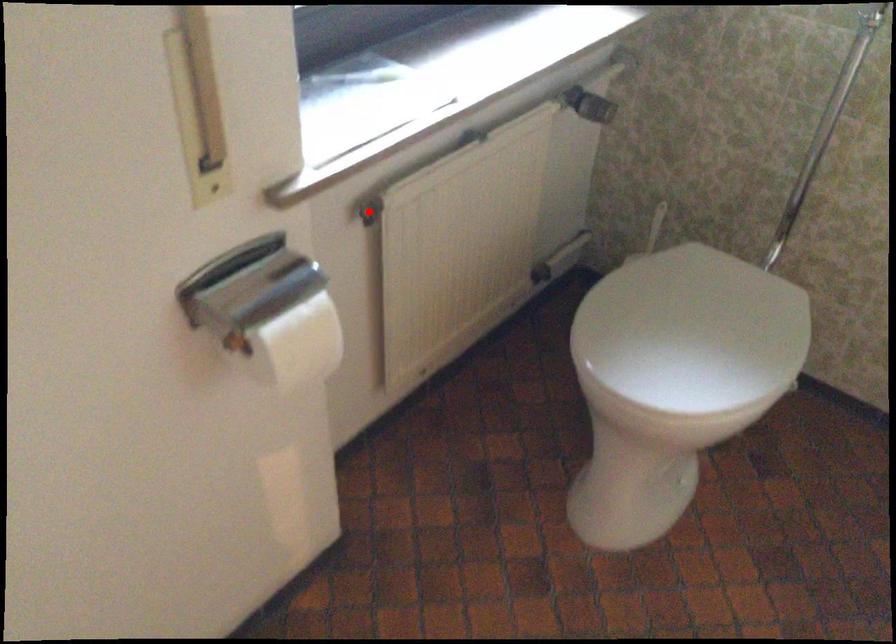
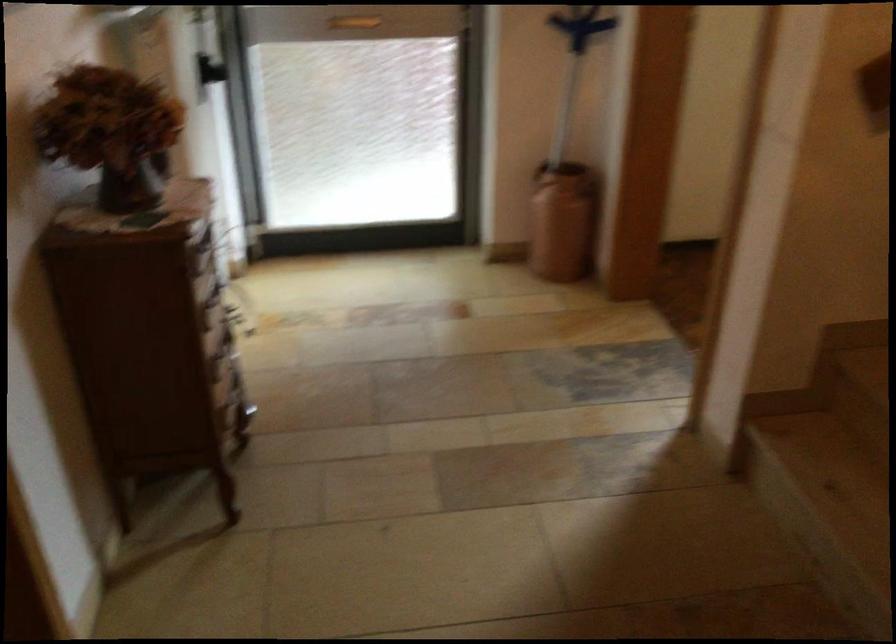
Question: I am providing you with two images of the same scene from different viewpoints. A red point is marked on the first image. At the location where the point appears in image 1, is it still visible in image 2?

Choices:
 (A) Yes
 (B) No

Answer: (B)